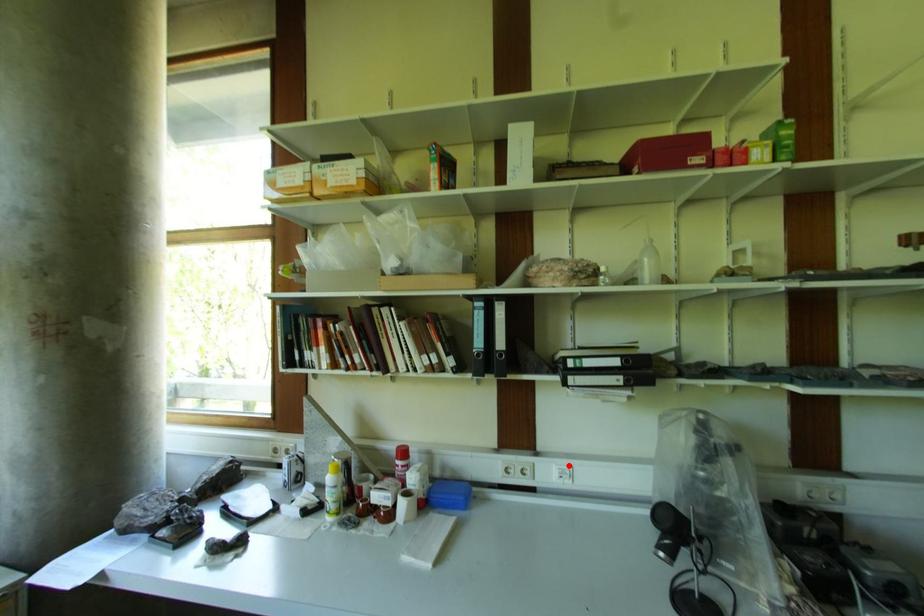
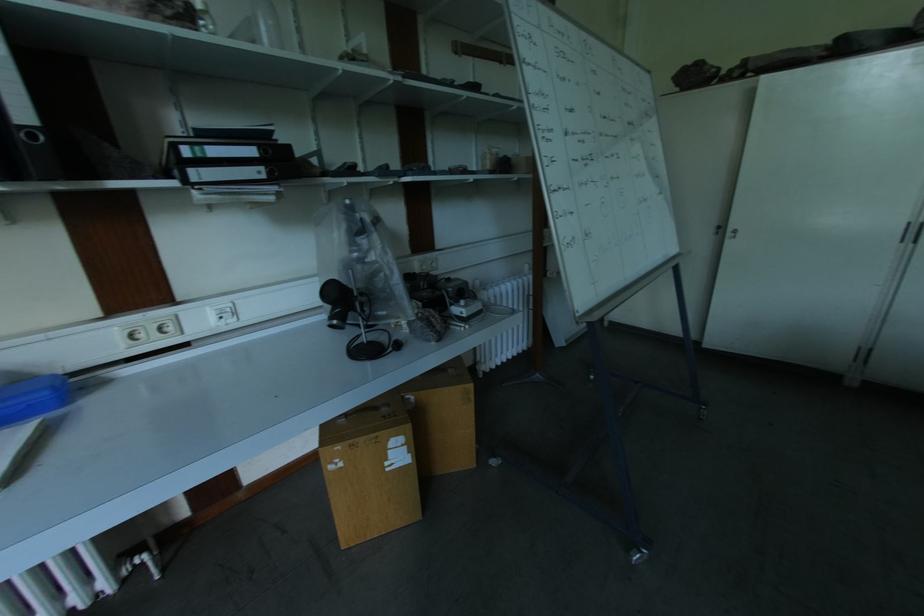
In the second image, find the point that corresponds to the highlighted location in the first image.

(226, 304)